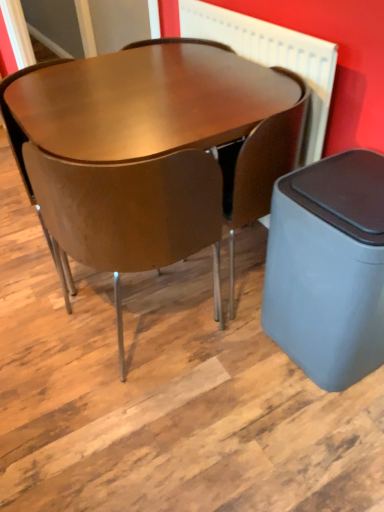
Question: From a real-world perspective, is glossy wood table at center physically below matte brown chair at center, the second chair positioned from the right?

Choices:
 (A) yes
 (B) no

Answer: (A)

Question: Does glossy wood table at center have a smaller size compared to matte brown chair at center, which is the 1th chair in left-to-right order?

Choices:
 (A) yes
 (B) no

Answer: (B)

Question: Is glossy wood table at center looking in the opposite direction of matte brown chair at center, which is the 1th chair in left-to-right order?

Choices:
 (A) no
 (B) yes

Answer: (A)

Question: Does glossy wood table at center have a lesser width compared to matte brown chair at center, which is the 1th chair in left-to-right order?

Choices:
 (A) yes
 (B) no

Answer: (B)

Question: Does glossy wood table at center have a larger size compared to matte brown chair at center, which is the 1th chair in left-to-right order?

Choices:
 (A) no
 (B) yes

Answer: (B)

Question: Is matte brown chair at center, the second chair positioned from the right, inside glossy wood table at center?

Choices:
 (A) no
 (B) yes

Answer: (B)

Question: From a real-world perspective, is matte brown chair at center, which ranks as the 1th chair in right-to-left order, on matte brown chair at center, which is the 1th chair in left-to-right order?

Choices:
 (A) no
 (B) yes

Answer: (A)

Question: Is matte brown chair at center, the second chair when ordered from left to right, further to camera compared to matte brown chair at center, the second chair positioned from the right?

Choices:
 (A) no
 (B) yes

Answer: (B)

Question: Considering the relative sizes of matte brown chair at center, the second chair when ordered from left to right, and matte brown chair at center, the second chair positioned from the right, in the image provided, is matte brown chair at center, the second chair when ordered from left to right, shorter than matte brown chair at center, the second chair positioned from the right,?

Choices:
 (A) no
 (B) yes

Answer: (B)

Question: Can you confirm if matte brown chair at center, which ranks as the 1th chair in right-to-left order, is positioned to the left of matte brown chair at center, which is the 1th chair in left-to-right order?

Choices:
 (A) yes
 (B) no

Answer: (B)

Question: From the image's perspective, is matte brown chair at center, which ranks as the 1th chair in right-to-left order, below matte brown chair at center, the second chair positioned from the right?

Choices:
 (A) no
 (B) yes

Answer: (A)

Question: From the image's perspective, does matte brown chair at center, which ranks as the 1th chair in right-to-left order, appear higher than matte brown chair at center, the second chair positioned from the right?

Choices:
 (A) no
 (B) yes

Answer: (B)

Question: Is matte brown chair at center, which is the 1th chair in left-to-right order, touching glossy wood table at center?

Choices:
 (A) yes
 (B) no

Answer: (B)